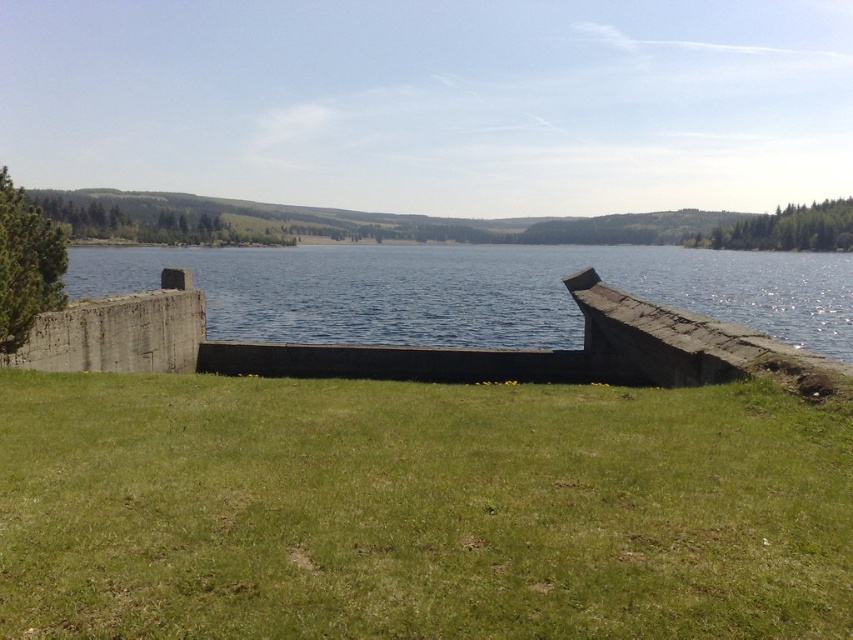
You are standing at the edge of the lake and want to walk to the gray concrete wall at left. Which direction should you face to reach it without crossing the green grassy at center?

You should face to the left because the gray concrete wall at left is located to the left of the green grassy at center, so facing left will allow you to reach it without crossing the grassy area.

You are standing at the edge of the lake and want to walk towards the gray concrete wall at left. Which direction should you walk to avoid stepping on the green grassy at center?

The green grassy at center is in front of the gray concrete wall at left, so you should walk around to the side of the gray concrete wall at left to avoid stepping on the green grassy at center.